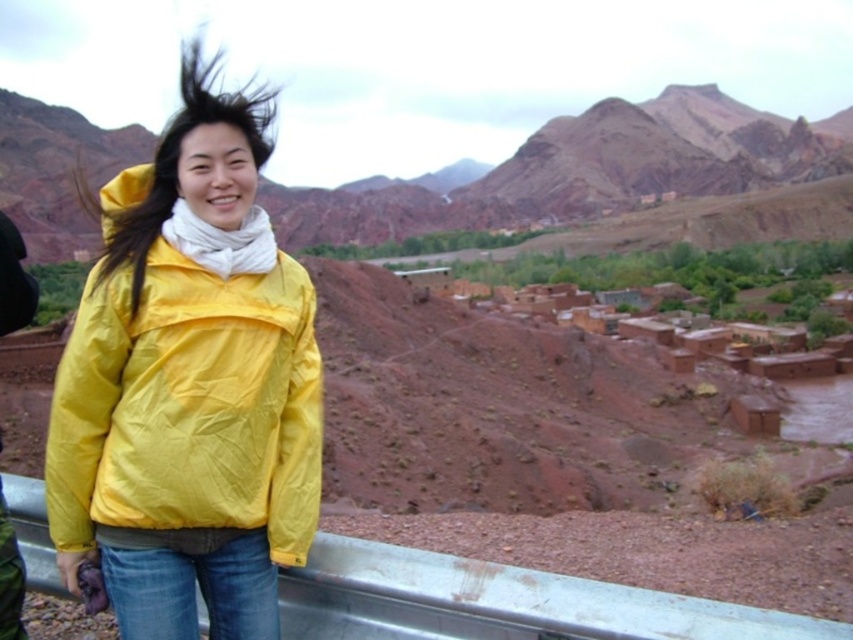
At what (x,y) coordinates should I click in order to perform the action: click on yellow matte jacket at center. Please return your answer as a coordinate pair (x, y). This screenshot has width=853, height=640. Looking at the image, I should click on (189, 406).

Does point (84, 461) come behind point (274, 106)?

No.

Where is `yellow matte jacket at center`? yellow matte jacket at center is located at coordinates (189, 406).

Can you confirm if brown mud-brick village at center is taller than dark brown silky hair at center?

Incorrect, brown mud-brick village at center's height is not larger of dark brown silky hair at center's.

Is brown mud-brick village at center in front of dark brown silky hair at center?

That is False.

Is point (759, 342) farther from viewer compared to point (154, 188)?

Yes, point (759, 342) is farther from viewer.

At what (x,y) coordinates should I click in order to perform the action: click on brown mud-brick village at center. Please return your answer as a coordinate pair (x, y). The image size is (853, 640). Looking at the image, I should click on (659, 326).

Which is below, yellow matte jacket at center or brown mud-brick village at center?

yellow matte jacket at center is below.

Does yellow matte jacket at center appear on the right side of brown mud-brick village at center?

In fact, yellow matte jacket at center is to the left of brown mud-brick village at center.

Is point (140, 348) farther from viewer compared to point (830, 360)?

No, (140, 348) is closer to viewer.

This screenshot has height=640, width=853. I want to click on yellow matte jacket at center, so click(x=189, y=406).